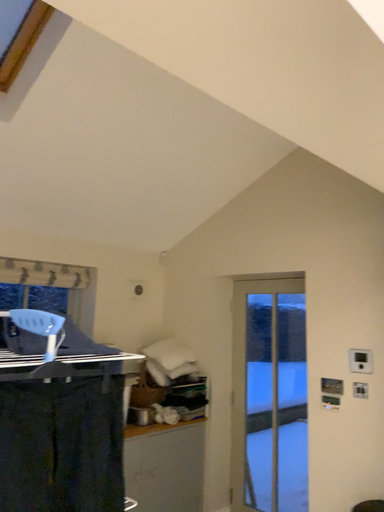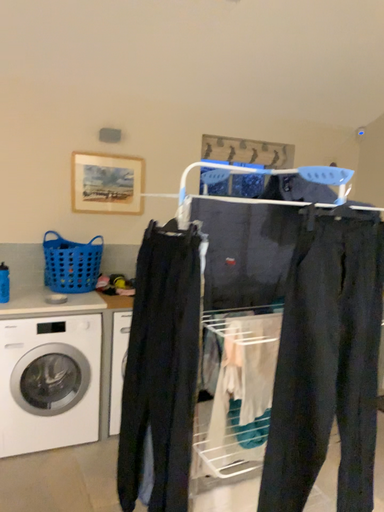
Question: Which way did the camera rotate in the video?

Choices:
 (A) rotated downward
 (B) rotated upward

Answer: (A)